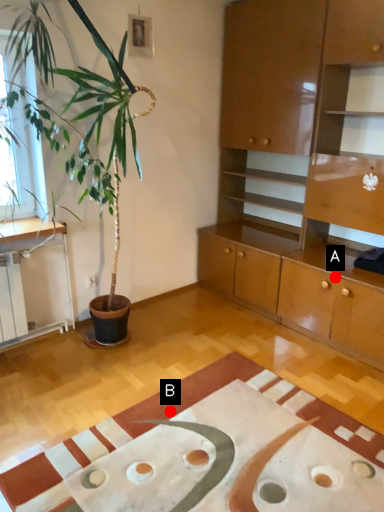
Question: Two points are circled on the image, labeled by A and B beside each circle. Which point is further to the camera?

Choices:
 (A) A is further
 (B) B is further

Answer: (A)